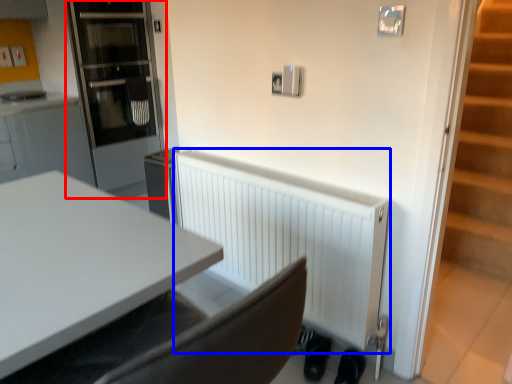
Question: Which object appears farthest to the camera in this image, glass door (highlighted by a red box) or radiator (highlighted by a blue box)?

Choices:
 (A) glass door
 (B) radiator

Answer: (A)